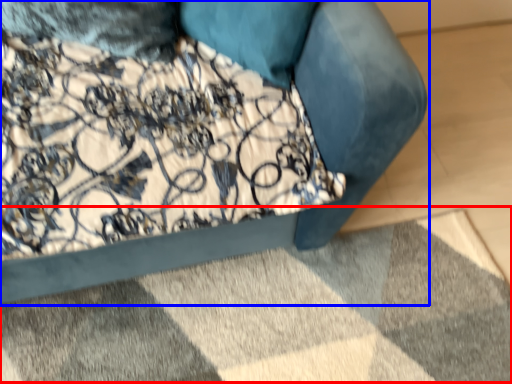
Question: Which point is closer to the camera, mat (highlighted by a red box) or furniture (highlighted by a blue box)?

Choices:
 (A) mat
 (B) furniture

Answer: (B)